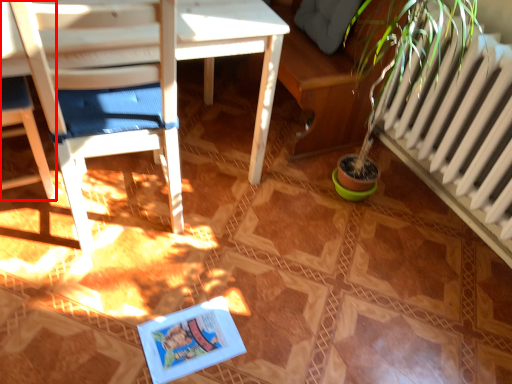
Question: In this image, where is chair (annotated by the red box) located relative to chair?

Choices:
 (A) left
 (B) right

Answer: (A)